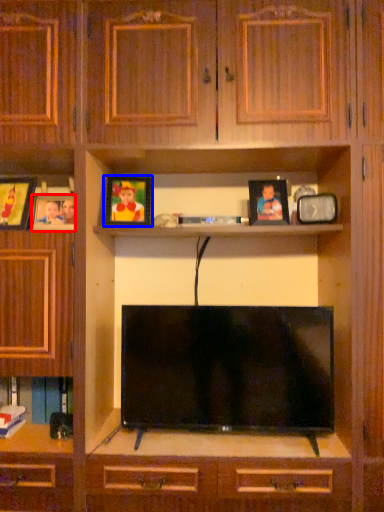
Question: Which object is further to the camera taking this photo, picture frame (highlighted by a red box) or picture frame (highlighted by a blue box)?

Choices:
 (A) picture frame
 (B) picture frame

Answer: (B)